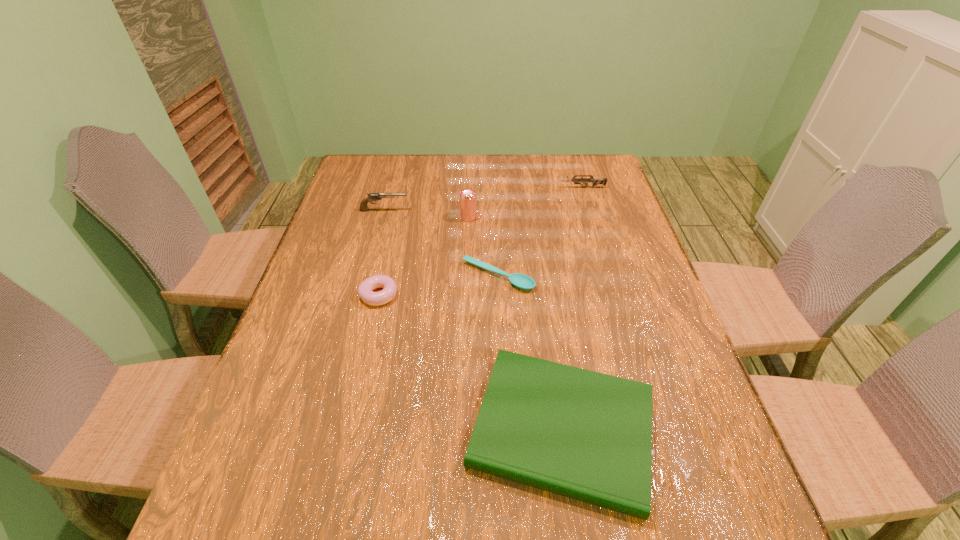
At what (x,y) coordinates should I click in order to perform the action: click on doughnut positioned at the left edge. Please return your answer as a coordinate pair (x, y). This screenshot has width=960, height=540. Looking at the image, I should click on (365, 290).

At what (x,y) coordinates should I click in order to perform the action: click on gun positioned at the right edge. Please return your answer as a coordinate pair (x, y). Image resolution: width=960 pixels, height=540 pixels. Looking at the image, I should click on coord(595,181).

Where is `paperback book located in the right edge section of the desktop`? paperback book located in the right edge section of the desktop is located at coordinates (585, 435).

The width and height of the screenshot is (960, 540). Find the location of `object positioned at the far right corner`. object positioned at the far right corner is located at coordinates 595,181.

In order to click on object positioned at the near right corner in this screenshot , I will do `click(585, 435)`.

What are the coordinates of `free spot at the far edge of the desktop` in the screenshot? It's located at (398, 166).

You are a GUI agent. You are given a task and a screenshot of the screen. Output one action in this format:
    pyautogui.click(x=<x>, y=<y>)
    Task: Click on the free region at the left edge of the desktop
    Image resolution: width=960 pixels, height=540 pixels.
    Given the screenshot: What is the action you would take?
    pyautogui.click(x=268, y=392)

Locate an element on the screen. Image resolution: width=960 pixels, height=540 pixels. vacant area at the right edge of the desktop is located at coordinates (668, 317).

At what (x,y) coordinates should I click in order to perform the action: click on free space at the far left corner of the desktop. Please return your answer as a coordinate pair (x, y). This screenshot has width=960, height=540. Looking at the image, I should click on (350, 176).

At what (x,y) coordinates should I click in order to perform the action: click on vacant space at the near right corner. Please return your answer as a coordinate pair (x, y). The image size is (960, 540). Looking at the image, I should click on (703, 519).